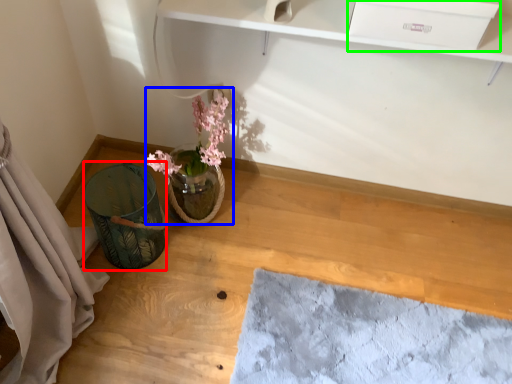
Question: Which is farther away from vase (highlighted by a red box)? floral arrangement (highlighted by a blue box) or drawer (highlighted by a green box)?

Choices:
 (A) floral arrangement
 (B) drawer

Answer: (B)